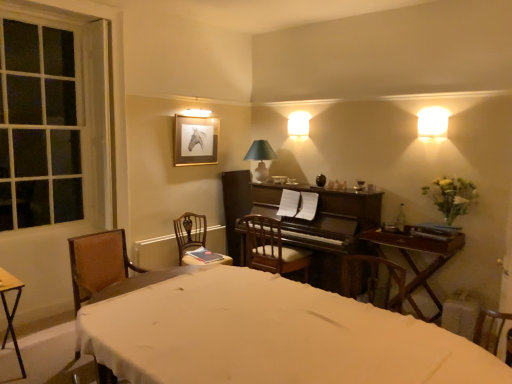
Question: Would you say green fabric lampshade at upper center, which is the 1th lamp from left to right, is to the left or to the right of gold-framed horse portrait at upper center in the picture?

Choices:
 (A) right
 (B) left

Answer: (A)

Question: Relative to gold-framed horse portrait at upper center, is green fabric lampshade at upper center, the first lamp when ordered from bottom to top, in front or behind?

Choices:
 (A) behind
 (B) front

Answer: (A)

Question: Based on their relative distances, which object is nearer to the wooden table at right?

Choices:
 (A) wooden chair with cushion at center, the 3th chair when ordered from left to right
 (B) clear glass window at left
 (C) white matte vase at right
 (D) green fabric lampshade at upper center, which is the 1th lamp from left to right
 (E) brown fabric chair at left, which appears as the third chair when viewed from the right

Answer: (C)

Question: Which of these objects is positioned farthest from the brown wooden chair at center, placed as the 2th chair when sorted from left to right?

Choices:
 (A) white fabric bed at lower left
 (B) clear glass window at left
 (C) yellow wood desk at lower left
 (D) white matte vase at right
 (E) wooden table at right

Answer: (D)